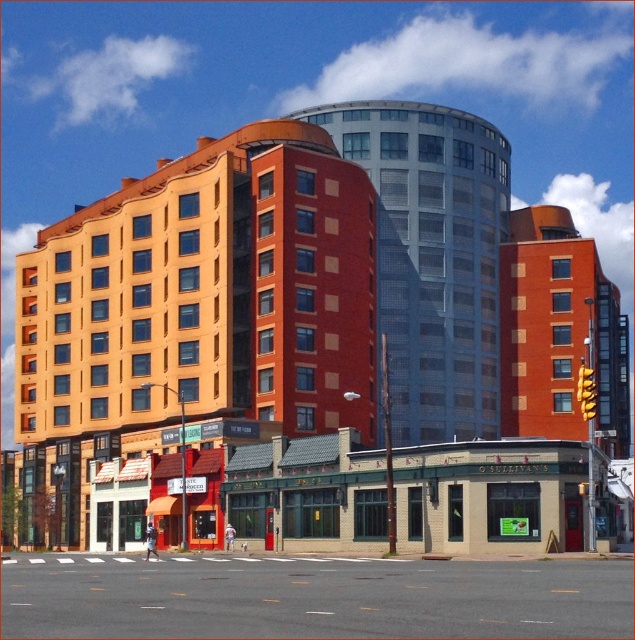
Which is behind, point (356, 435) or point (498, 360)?

Point (498, 360)

Is orange brick building at center to the right of matte brick building at center-right from the viewer's perspective?

Incorrect, orange brick building at center is not on the right side of matte brick building at center-right.

At what (x,y) coordinates should I click in order to perform the action: click on orange brick building at center. Please return your answer as a coordinate pair (x, y). Looking at the image, I should click on (305, 314).

How far apart are orange brick building at center and smooth glass building at center?

orange brick building at center and smooth glass building at center are 10.01 meters apart from each other.

From the picture: Can you confirm if orange brick building at center is bigger than smooth glass building at center?

Correct, orange brick building at center is larger in size than smooth glass building at center.

Find the location of a particular element. orange brick building at center is located at coordinates (305, 314).

Can you confirm if smooth glass building at center is shorter than matte brick building at center-right?

No, smooth glass building at center is not shorter than matte brick building at center-right.

Is smooth glass building at center above matte brick building at center-right?

Yes, smooth glass building at center is above matte brick building at center-right.

Identify the location of smooth glass building at center. This screenshot has width=635, height=640. (432, 257).